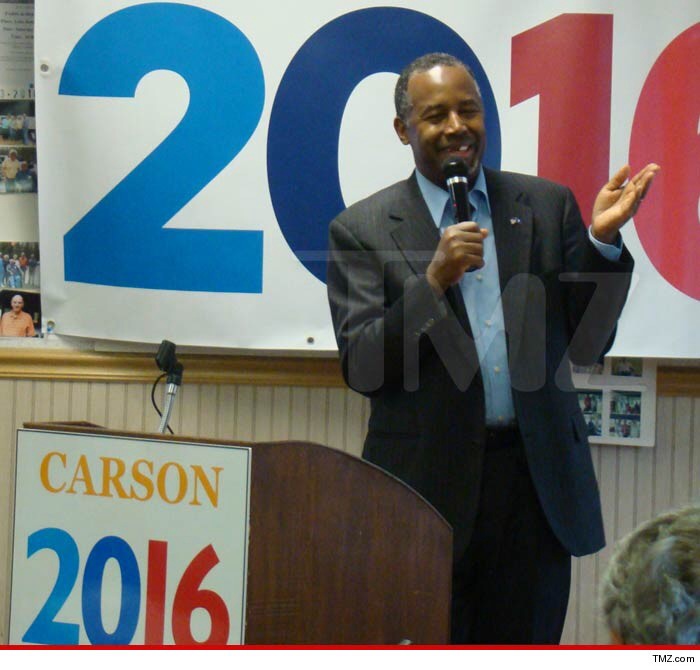
I want to click on placard, so click(x=209, y=529).